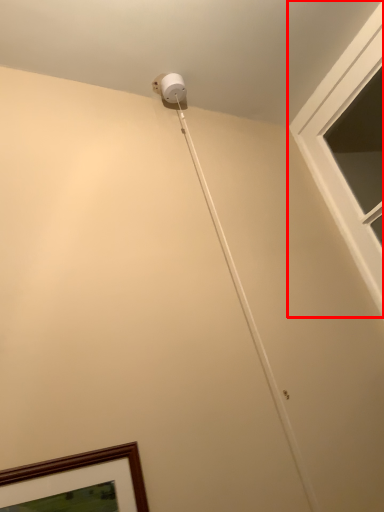
Question: From the image's perspective, considering the relative positions of window (annotated by the red box) and string in the image provided, where is window (annotated by the red box) located with respect to the staircase?

Choices:
 (A) below
 (B) above

Answer: (B)